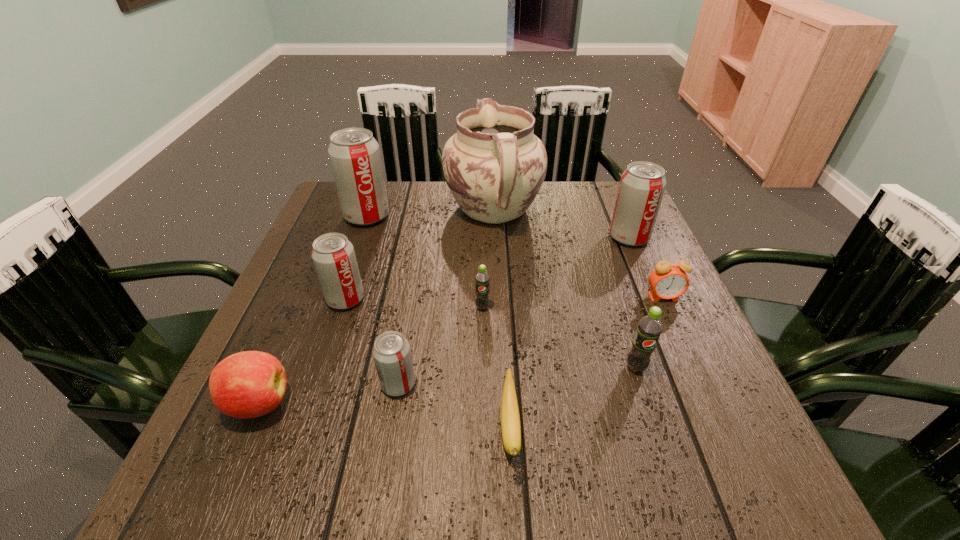
At what (x,y) coordinates should I click in order to perform the action: click on free space at the far edge of the desktop. Please return your answer as a coordinate pair (x, y). Looking at the image, I should click on (540, 208).

I want to click on vacant space at the near edge, so click(354, 461).

What are the coordinates of `free space at the left edge` in the screenshot? It's located at (303, 349).

Find the location of a particular element. The image size is (960, 540). free space at the right edge is located at coordinates (621, 290).

Identify the location of vacant area at the near left corner of the desktop. (256, 450).

This screenshot has width=960, height=540. I want to click on unoccupied position between the alarm clock and the rightmost gray soda can, so click(x=646, y=267).

This screenshot has width=960, height=540. Find the location of `free spot between the pink alarm clock and the farther green soda`. free spot between the pink alarm clock and the farther green soda is located at coordinates (573, 302).

The image size is (960, 540). Find the location of `vacant space that's between the banana and the rightmost soda can`. vacant space that's between the banana and the rightmost soda can is located at coordinates (569, 333).

Where is `free area in between the second biggest gray soda can and the second soda can from right to left`? This screenshot has height=540, width=960. free area in between the second biggest gray soda can and the second soda can from right to left is located at coordinates (633, 302).

Locate an element on the screen. This screenshot has width=960, height=540. blank region between the pitcher and the banana is located at coordinates (502, 320).